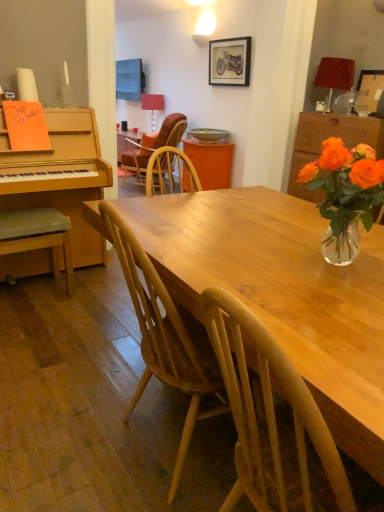
Describe the element at coordinates (326, 139) in the screenshot. I see `translucent glass vase at upper right, placed as the 2th cabinetry when sorted from back to front` at that location.

This screenshot has width=384, height=512. What are the coordinates of `matte red lampshade at upper right, which is the first lamp from right to left` in the screenshot? It's located at (335, 75).

How much space does matte red lampshade at upper right, which appears as the 2th lamp when viewed from the back, occupy horizontally?

33.12 centimeters.

What do you see at coordinates (211, 162) in the screenshot? Image resolution: width=384 pixels, height=512 pixels. I see `orange wood cabinet at center, marked as the second cabinetry in a front-to-back arrangement` at bounding box center [211, 162].

Looking at this image, what is the approximate width of orange wood cabinet at center, marked as the second cabinetry in a front-to-back arrangement?

It is 19.44 inches.

Find the location of a particular element. This screenshot has height=512, width=384. light gray cushioned stool at left, which is counted as the first chair, starting from the front is located at coordinates (38, 236).

How much space does wooden textured chair at center, placed as the second chair when sorted from front to back, occupy horizontally?

The width of wooden textured chair at center, placed as the second chair when sorted from front to back, is 31.90 inches.

Find the location of `wooden textured chair at center, which appears as the second chair when ordered from the bottom`. wooden textured chair at center, which appears as the second chair when ordered from the bottom is located at coordinates (153, 147).

Describe the element at coordinates (153, 105) in the screenshot. I see `matte red lampshade at upper center, the first lamp positioned from the back` at that location.

Identify the location of translucent glass vase at upper right, placed as the 2th cabinetry when sorted from back to front. Image resolution: width=384 pixels, height=512 pixels. (326, 139).

Considering the sizes of objects light brown wooden table at center and light gray cushioned stool at left, acting as the second chair starting from the right, in the image provided, who is smaller, light brown wooden table at center or light gray cushioned stool at left, acting as the second chair starting from the right,?

Smaller between the two is light gray cushioned stool at left, acting as the second chair starting from the right.

Would you say light brown wooden table at center is outside light gray cushioned stool at left, the 2th chair in the back-to-front sequence?

Indeed, light brown wooden table at center is completely outside light gray cushioned stool at left, the 2th chair in the back-to-front sequence.

Looking at this image, can you tell me how much light brown wooden table at center and light gray cushioned stool at left, which is counted as the first chair, starting from the front, differ in facing direction?

The facing directions of light brown wooden table at center and light gray cushioned stool at left, which is counted as the first chair, starting from the front, are 86.8 degrees apart.

Considering the sizes of objects wooden picture frame at upper center, placed as the second picture frame when sorted from right to left, and orange wood cabinet at center, marked as the second cabinetry in a front-to-back arrangement, in the image provided, who is wider, wooden picture frame at upper center, placed as the second picture frame when sorted from right to left, or orange wood cabinet at center, marked as the second cabinetry in a front-to-back arrangement,?

orange wood cabinet at center, marked as the second cabinetry in a front-to-back arrangement, is wider.

You are a GUI agent. You are given a task and a screenshot of the screen. Output one action in this format:
    pyautogui.click(x=<x>, y=<y>)
    Task: Click on the 1st cabinetry positioned below the wooden picture frame at upper center, arranged as the 2th picture frame when viewed from the front (from the image's perspective)
    
    Given the screenshot: What is the action you would take?
    pyautogui.click(x=211, y=162)

How different are the orientations of wooden picture frame at upper center, arranged as the 2th picture frame when viewed from the front, and orange wood cabinet at center, marked as the second cabinetry in a front-to-back arrangement, in degrees?

wooden picture frame at upper center, arranged as the 2th picture frame when viewed from the front, and orange wood cabinet at center, marked as the second cabinetry in a front-to-back arrangement, are facing 1.73 degrees away from each other.

In the scene shown: From a real-world perspective, relative to matte red lampshade at upper center, the second lamp from the right, is translucent glass vase at upper right vertically above or below?

Clearly, from a real-world perspective, translucent glass vase at upper right is above matte red lampshade at upper center, the second lamp from the right.

Is point (328, 245) closer to camera compared to point (154, 94)?

Yes, point (328, 245) is in front of point (154, 94).

How many degrees apart are the facing directions of translucent glass vase at upper right and matte red lampshade at upper center, the second lamp from the right?

They differ by 91.9 degrees in their facing directions.

Who is taller, light gray cushioned stool at left, which is counted as the first chair, starting from the front, or orange wood cabinet at center, marked as the second cabinetry in a front-to-back arrangement?

With more height is orange wood cabinet at center, marked as the second cabinetry in a front-to-back arrangement.

From a real-world perspective, is light gray cushioned stool at left, the 2th chair in the back-to-front sequence, on orange wood cabinet at center, marked as the second cabinetry in a front-to-back arrangement?

Actually, light gray cushioned stool at left, the 2th chair in the back-to-front sequence, is physically below orange wood cabinet at center, marked as the second cabinetry in a front-to-back arrangement, in the real world.

Considering the relative positions of light gray cushioned stool at left, acting as the second chair starting from the right, and orange wood cabinet at center, placed as the 2th cabinetry when sorted from right to left, in the image provided, is light gray cushioned stool at left, acting as the second chair starting from the right, behind orange wood cabinet at center, placed as the 2th cabinetry when sorted from right to left,?

No, it is not.

Considering the relative sizes of light gray cushioned stool at left, which ranks as the 1th chair in left-to-right order, and orange wood cabinet at center, marked as the second cabinetry in a front-to-back arrangement, in the image provided, is light gray cushioned stool at left, which ranks as the 1th chair in left-to-right order, wider than orange wood cabinet at center, marked as the second cabinetry in a front-to-back arrangement,?

No.

Considering the sizes of objects light gray cushioned stool at left, acting as the second chair starting from the right, and matte red lampshade at upper center, the first lamp positioned from the back, in the image provided, who is thinner, light gray cushioned stool at left, acting as the second chair starting from the right, or matte red lampshade at upper center, the first lamp positioned from the back,?

matte red lampshade at upper center, the first lamp positioned from the back.

Is light gray cushioned stool at left, the 2th chair in the back-to-front sequence, in contact with matte red lampshade at upper center, marked as the 1th lamp in a left-to-right arrangement?

No, light gray cushioned stool at left, the 2th chair in the back-to-front sequence, is not next to matte red lampshade at upper center, marked as the 1th lamp in a left-to-right arrangement.

Does light gray cushioned stool at left, the first chair in the bottom-to-top sequence, lie in front of matte red lampshade at upper center, the first lamp positioned from the back?

That is True.

From a real-world perspective, relative to matte red lampshade at upper center, the 2th lamp viewed from the front, is light gray cushioned stool at left, acting as the second chair starting from the right, vertically above or below?

From a real-world perspective, light gray cushioned stool at left, acting as the second chair starting from the right, is physically below matte red lampshade at upper center, the 2th lamp viewed from the front.

From the image's perspective, which is above, wooden picture frame at upper center, the first picture frame viewed from the top, or wooden textured chair at center, which ranks as the first chair in top-to-bottom order?

From the image's view, wooden picture frame at upper center, the first picture frame viewed from the top, is above.

From a real-world perspective, is wooden picture frame at upper center, placed as the second picture frame when sorted from right to left, physically located above or below wooden textured chair at center, which appears as the second chair when ordered from the bottom?

wooden picture frame at upper center, placed as the second picture frame when sorted from right to left, is situated higher than wooden textured chair at center, which appears as the second chair when ordered from the bottom, in the real world.

Considering their positions, is wooden picture frame at upper center, arranged as the 2th picture frame when viewed from the front, located in front of or behind wooden textured chair at center, arranged as the first chair when viewed from the back?

Clearly, wooden picture frame at upper center, arranged as the 2th picture frame when viewed from the front, is in front of wooden textured chair at center, arranged as the first chair when viewed from the back.

What's the angular difference between wooden picture frame at upper center, the first picture frame viewed from the top, and wooden textured chair at center, which ranks as the first chair in top-to-bottom order,'s facing directions?

1.34 degrees.

Which of these two, matte red lampshade at upper center, acting as the 2th lamp starting from the bottom, or wooden textured chair at center, which appears as the second chair when ordered from the bottom, is thinner?

matte red lampshade at upper center, acting as the 2th lamp starting from the bottom.

Is matte red lampshade at upper center, which is counted as the 1th lamp, starting from the top, not close to wooden textured chair at center, placed as the second chair when sorted from front to back?

matte red lampshade at upper center, which is counted as the 1th lamp, starting from the top, is positioned a significant distance from wooden textured chair at center, placed as the second chair when sorted from front to back.

Considering the relative sizes of matte red lampshade at upper center, the first lamp positioned from the back, and wooden textured chair at center, which is the second chair from left to right, in the image provided, is matte red lampshade at upper center, the first lamp positioned from the back, taller than wooden textured chair at center, which is the second chair from left to right,?

No.

Can you tell me how much matte red lampshade at upper center, the 2th lamp viewed from the front, and wooden textured chair at center, which is the second chair from left to right, differ in facing direction?

The angular difference between matte red lampshade at upper center, the 2th lamp viewed from the front, and wooden textured chair at center, which is the second chair from left to right, is 2.3 degrees.

Identify the location of desk that is on the right side of light gray cushioned stool at left, acting as the second chair starting from the right. (283, 293).

At what (x,y) coordinates should I click in order to perform the action: click on the 2nd picture frame above the orange wood cabinet at center, the first cabinetry in the left-to-right sequence (from the image's perspective). Please return your answer as a coordinate pair (x, y). The width and height of the screenshot is (384, 512). Looking at the image, I should click on (230, 61).

Which object lies further to the anchor point translucent glass vase at upper right, light gray cushioned stool at left, which is counted as the first chair, starting from the front, or matte red lampshade at upper center, the second lamp from the right?

Among the two, matte red lampshade at upper center, the second lamp from the right, is located further to translucent glass vase at upper right.

Considering their positions, is light brown wooden table at center positioned closer to translucent glass vase at upper right than wooden picture frame at upper center, placed as the second picture frame when sorted from right to left?

light brown wooden table at center is closer to translucent glass vase at upper right.

Considering their positions, is translucent glass vase at upper right, placed as the 2th cabinetry when sorted from back to front, positioned closer to light gray cushioned stool at left, which ranks as the 1th chair in left-to-right order, than translucent glass vase at upper right?

Among the two, translucent glass vase at upper right is located nearer to light gray cushioned stool at left, which ranks as the 1th chair in left-to-right order.

Looking at the image, which one is located closer to matte red lampshade at upper center, marked as the 1th lamp in a left-to-right arrangement, wooden textured chair at center, which is counted as the first chair, starting from the right, or translucent glass vase at upper right?

wooden textured chair at center, which is counted as the first chair, starting from the right.

Estimate the real-world distances between objects in this image. Which object is further from light gray cushioned stool at left, the first chair in the bottom-to-top sequence, matte red lampshade at upper center, which is counted as the 1th lamp, starting from the top, or wooden picture frame at upper center, which is the 1th picture frame from back to front?

matte red lampshade at upper center, which is counted as the 1th lamp, starting from the top, lies further to light gray cushioned stool at left, the first chair in the bottom-to-top sequence, than the other object.

Which object lies further to the anchor point wooden picture frame at upper center, which appears as the 2th picture frame when ordered from the bottom, wooden picture frame at upper right, the first picture frame when ordered from right to left, or matte red lampshade at upper right, which is the first lamp from right to left?

Among the two, wooden picture frame at upper right, the first picture frame when ordered from right to left, is located further to wooden picture frame at upper center, which appears as the 2th picture frame when ordered from the bottom.

From the image, which object appears to be farther from wooden picture frame at upper center, which is the 1th picture frame from back to front, wooden picture frame at upper right, which is the first picture frame from bottom to top, or orange wood cabinet at center, marked as the second cabinetry in a front-to-back arrangement?

Among the two, wooden picture frame at upper right, which is the first picture frame from bottom to top, is located further to wooden picture frame at upper center, which is the 1th picture frame from back to front.

Estimate the real-world distances between objects in this image. Which object is further from wooden textured chair at center, which appears as the second chair when ordered from the bottom, orange wood cabinet at center, which is counted as the 1th cabinetry, starting from the back, or light gray cushioned stool at left, the 2th chair in the back-to-front sequence?

orange wood cabinet at center, which is counted as the 1th cabinetry, starting from the back, lies further to wooden textured chair at center, which appears as the second chair when ordered from the bottom, than the other object.

This screenshot has width=384, height=512. I want to click on chair between translucent glass vase at upper right and matte red lampshade at upper right, positioned as the second lamp in left-to-right order, from front to back, so [38, 236].

At what (x,y) coordinates should I click in order to perform the action: click on lamp positioned between translucent glass vase at upper right and orange wood cabinet at center, marked as the second cabinetry in a front-to-back arrangement, from near to far. Please return your answer as a coordinate pair (x, y). This screenshot has height=512, width=384. Looking at the image, I should click on (335, 75).

At what (x,y) coordinates should I click in order to perform the action: click on lamp between wooden textured chair at center, which appears as the second chair when ordered from the bottom, and translucent glass vase at upper right, the first cabinetry when ordered from right to left, in the horizontal direction. Please return your answer as a coordinate pair (x, y). The image size is (384, 512). Looking at the image, I should click on (335, 75).

At what (x,y) coordinates should I click in order to perform the action: click on lamp between light brown wooden table at center and matte red lampshade at upper center, the first lamp positioned from the back, from front to back. Please return your answer as a coordinate pair (x, y). The height and width of the screenshot is (512, 384). Looking at the image, I should click on (335, 75).